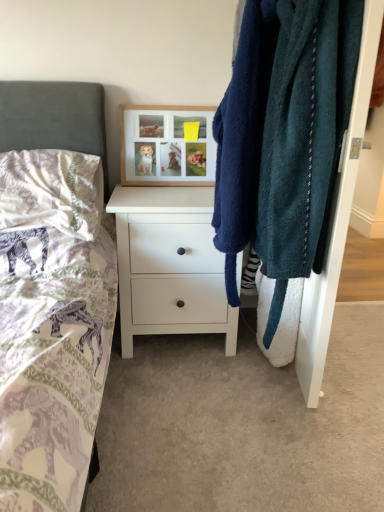
The width and height of the screenshot is (384, 512). Describe the element at coordinates (336, 223) in the screenshot. I see `teal fuzzy robe at right` at that location.

In order to face teal fuzzy robe at right, should I rotate leftwards or rightwards?

Turn right approximately 13.544 degrees to face it.

From the picture: Measure the distance between woodenobject at upper center and camera.

woodenobject at upper center and camera are 1.74 meters apart from each other.

You are a GUI agent. You are given a task and a screenshot of the screen. Output one action in this format:
    pyautogui.click(x=<x>, y=<y>)
    Task: Click on the white matte chest of drawers at center
    Image resolution: width=384 pixels, height=512 pixels.
    Given the screenshot: What is the action you would take?
    pyautogui.click(x=169, y=265)

The height and width of the screenshot is (512, 384). I want to click on silky white pillow at left, so click(x=51, y=191).

You are a GUI agent. You are given a task and a screenshot of the screen. Output one action in this format:
    pyautogui.click(x=<x>, y=<y>)
    Task: Click on the teal fuzzy robe at right
    
    Given the screenshot: What is the action you would take?
    pyautogui.click(x=336, y=223)

Does teal fuzzy robe at right appear on the left side of woodenobject at upper center?

No, teal fuzzy robe at right is not to the left of woodenobject at upper center.

From the image's perspective, is teal fuzzy robe at right positioned above or below woodenobject at upper center?

From the image's perspective, teal fuzzy robe at right appears below woodenobject at upper center.

At what (x,y) coordinates should I click in order to perform the action: click on picture frame lying behind the teal fuzzy robe at right. Please return your answer as a coordinate pair (x, y). The width and height of the screenshot is (384, 512). Looking at the image, I should click on (167, 145).

Which object is closer to the camera taking this photo, teal fuzzy robe at right or woodenobject at upper center?

Positioned in front is teal fuzzy robe at right.

Does silky white pillow at left appear on the left side of woodenobject at upper center?

Indeed, silky white pillow at left is positioned on the left side of woodenobject at upper center.

Which of these two, silky white pillow at left or woodenobject at upper center, is smaller?

With smaller size is woodenobject at upper center.

Locate an element on the screen. The image size is (384, 512). pillow beneath the woodenobject at upper center (from a real-world perspective) is located at coordinates (51, 191).

Does white matte chest of drawers at center have a lesser height compared to woodenobject at upper center?

No.

Looking at this image, from the image's perspective, which one is positioned higher, white matte chest of drawers at center or woodenobject at upper center?

From the image's view, woodenobject at upper center is above.

Considering the positions of point (142, 280) and point (188, 158), is point (142, 280) closer or farther from the camera than point (188, 158)?

Point (142, 280) is closer to the camera than point (188, 158).

Looking at this image, which object is positioned more to the right, woodenobject at upper center or teal fuzzy robe at right?

teal fuzzy robe at right is more to the right.

Is point (140, 140) closer or farther from the camera than point (366, 32)?

Point (140, 140) appears to be farther away from the viewer than point (366, 32).

Who is bigger, woodenobject at upper center or teal fuzzy robe at right?

teal fuzzy robe at right is bigger.

Is the surface of woodenobject at upper center in direct contact with teal fuzzy robe at right?

No.

Looking at this image, which is less distant, (327, 291) or (188, 206)?

Point (327, 291) is positioned closer to the camera compared to point (188, 206).

Can you confirm if teal fuzzy robe at right is taller than white matte chest of drawers at center?

Yes, teal fuzzy robe at right is taller than white matte chest of drawers at center.

How many degrees apart are the facing directions of teal fuzzy robe at right and white matte chest of drawers at center?

The facing directions of teal fuzzy robe at right and white matte chest of drawers at center are 94.1 degrees apart.

From a real-world perspective, which object rests below the other?

In real-world perspective, silky white pillow at left is lower.

Could you tell me if silky white pillow at left is turned towards teal fuzzy robe at right?

No, silky white pillow at left is not aimed at teal fuzzy robe at right.

How far apart are silky white pillow at left and teal fuzzy robe at right?

36.26 inches.

At what (x,y) coordinates should I click in order to perform the action: click on closet in front of the silky white pillow at left. Please return your answer as a coordinate pair (x, y). Looking at the image, I should click on (336, 223).

From a real-world perspective, who is located higher, woodenobject at upper center or silky white pillow at left?

woodenobject at upper center, from a real-world perspective.

Consider the image. Between woodenobject at upper center and silky white pillow at left, which one has smaller size?

woodenobject at upper center.

Between woodenobject at upper center and silky white pillow at left, which one has less height?

Standing shorter between the two is silky white pillow at left.

At what (x,y) coordinates should I click in order to perform the action: click on closet that appears on the right of woodenobject at upper center. Please return your answer as a coordinate pair (x, y). This screenshot has height=512, width=384. Looking at the image, I should click on (336, 223).

You are a GUI agent. You are given a task and a screenshot of the screen. Output one action in this format:
    pyautogui.click(x=<x>, y=<y>)
    Task: Click on the pillow in front of the woodenobject at upper center
    This screenshot has width=384, height=512.
    Given the screenshot: What is the action you would take?
    pyautogui.click(x=51, y=191)

Which object lies nearer to the anchor point white matte chest of drawers at center, silky white pillow at left or woodenobject at upper center?

woodenobject at upper center lies closer to white matte chest of drawers at center than the other object.

Based on their spatial positions, is silky white pillow at left or white matte chest of drawers at center further from teal fuzzy robe at right?

silky white pillow at left is positioned further to the anchor teal fuzzy robe at right.

Which object lies nearer to the anchor point silky white pillow at left, white matte chest of drawers at center or teal fuzzy robe at right?

Among the two, white matte chest of drawers at center is located nearer to silky white pillow at left.

Looking at the image, which one is located further to silky white pillow at left, teal fuzzy robe at right or white matte chest of drawers at center?

teal fuzzy robe at right is positioned further to the anchor silky white pillow at left.

Which object lies further to the anchor point white matte chest of drawers at center, teal fuzzy robe at right or silky white pillow at left?

teal fuzzy robe at right is further to white matte chest of drawers at center.

Estimate the real-world distances between objects in this image. Which object is further from teal fuzzy robe at right, woodenobject at upper center or silky white pillow at left?

The object further to teal fuzzy robe at right is silky white pillow at left.

Which object lies nearer to the anchor point woodenobject at upper center, white matte chest of drawers at center or teal fuzzy robe at right?

white matte chest of drawers at center is closer to woodenobject at upper center.

Which object lies further to the anchor point silky white pillow at left, woodenobject at upper center or teal fuzzy robe at right?

Based on the image, teal fuzzy robe at right appears to be further to silky white pillow at left.

This screenshot has height=512, width=384. I want to click on picture frame between silky white pillow at left and teal fuzzy robe at right, so click(x=167, y=145).

Identify the location of picture frame between silky white pillow at left and white matte chest of drawers at center from left to right. (167, 145).

This screenshot has width=384, height=512. What are the coordinates of `chest of drawers between teal fuzzy robe at right and woodenobject at upper center along the z-axis` in the screenshot? It's located at (169, 265).

Where is `the chest of drawers situated between silky white pillow at left and teal fuzzy robe at right from left to right`? the chest of drawers situated between silky white pillow at left and teal fuzzy robe at right from left to right is located at coordinates click(x=169, y=265).